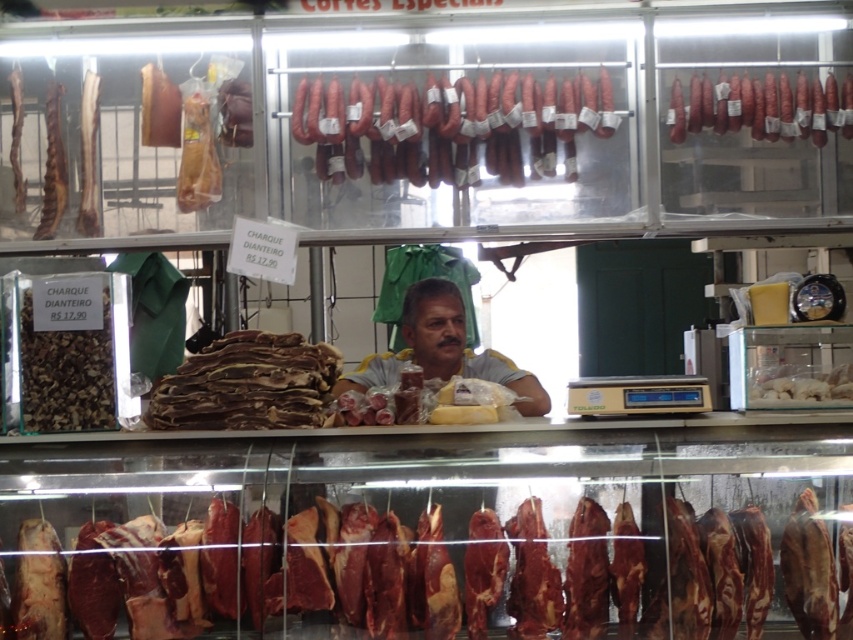
You are a customer at the butcher shop and want to compare the widths of the smoked sausage at center and the smoked brown meat at center. Which one is wider?

The smoked sausage at center might be wider than smoked brown meat at center.